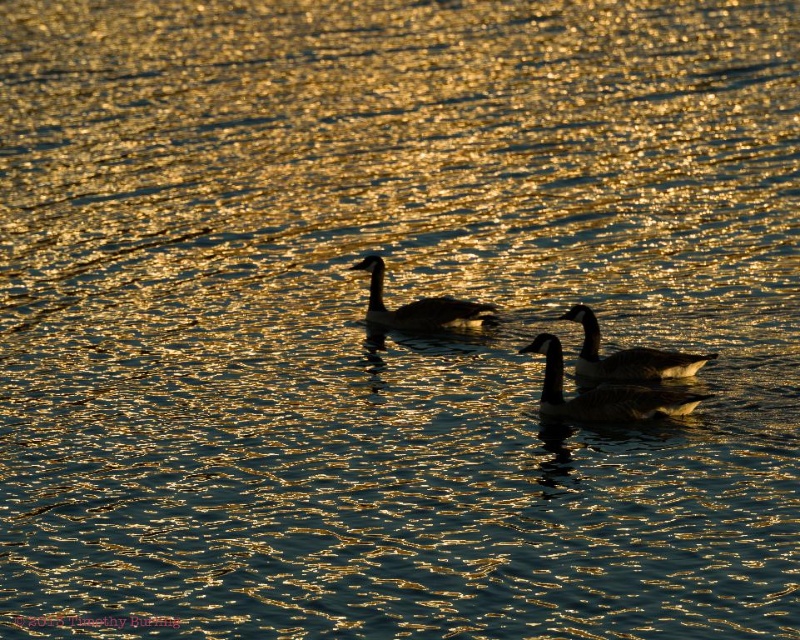
Question: Which point is farther to the camera?

Choices:
 (A) dark brown feathers at center
 (B) dark gray feathers at center
 (C) silhouette glossy duck at center

Answer: (C)

Question: Can you confirm if dark brown feathers at center is thinner than silhouette glossy duck at center?

Choices:
 (A) no
 (B) yes

Answer: (B)

Question: Among these objects, which one is nearest to the camera?

Choices:
 (A) silhouette glossy duck at center
 (B) dark gray feathers at center
 (C) dark brown feathers at center

Answer: (B)

Question: From the image, what is the correct spatial relationship of dark gray feathers at center in relation to silhouette glossy duck at center?

Choices:
 (A) left
 (B) right

Answer: (B)

Question: Which of these objects is positioned farthest from the dark gray feathers at center?

Choices:
 (A) dark brown feathers at center
 (B) silhouette glossy duck at center

Answer: (B)

Question: Can you confirm if dark brown feathers at center is thinner than silhouette glossy duck at center?

Choices:
 (A) yes
 (B) no

Answer: (A)